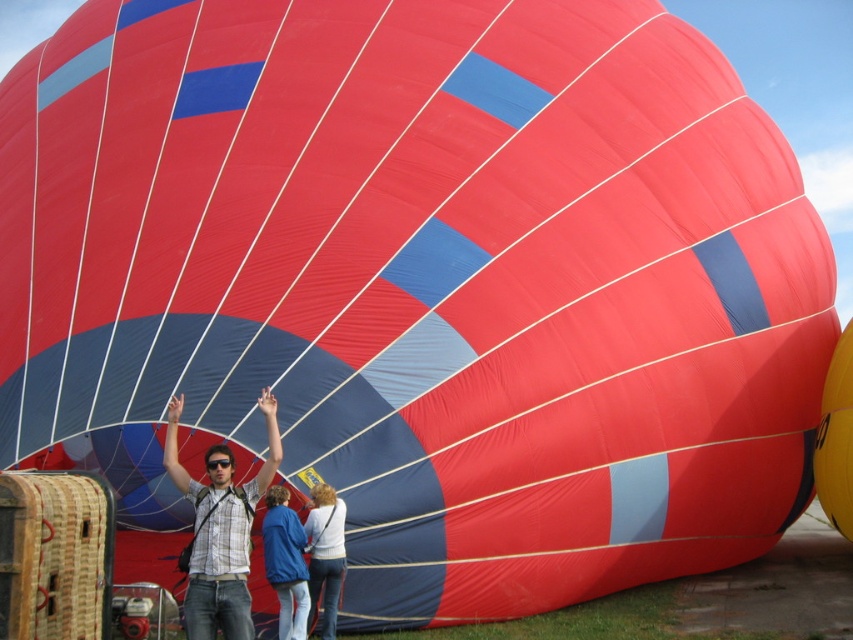
Question: Estimate the real-world distances between objects in this image. Which object is farther from the yellow matte balloon at center?

Choices:
 (A) blue fabric jacket at center
 (B) matte plaid shirt at center
 (C) white sweater at center

Answer: (B)

Question: Is matte plaid shirt at center to the right of yellow matte balloon at center from the viewer's perspective?

Choices:
 (A) no
 (B) yes

Answer: (A)

Question: Observing the image, what is the correct spatial positioning of yellow matte balloon at center in reference to white sweater at center?

Choices:
 (A) below
 (B) above

Answer: (A)

Question: Is the position of matte plaid shirt at center less distant than that of blue fabric jacket at center?

Choices:
 (A) yes
 (B) no

Answer: (A)

Question: Which of the following is the closest to the observer?

Choices:
 (A) (822, 410)
 (B) (299, 538)
 (C) (318, 557)

Answer: (B)

Question: Among these objects, which one is nearest to the camera?

Choices:
 (A) matte plaid shirt at center
 (B) yellow matte balloon at center
 (C) white sweater at center
 (D) blue fabric jacket at center

Answer: (A)